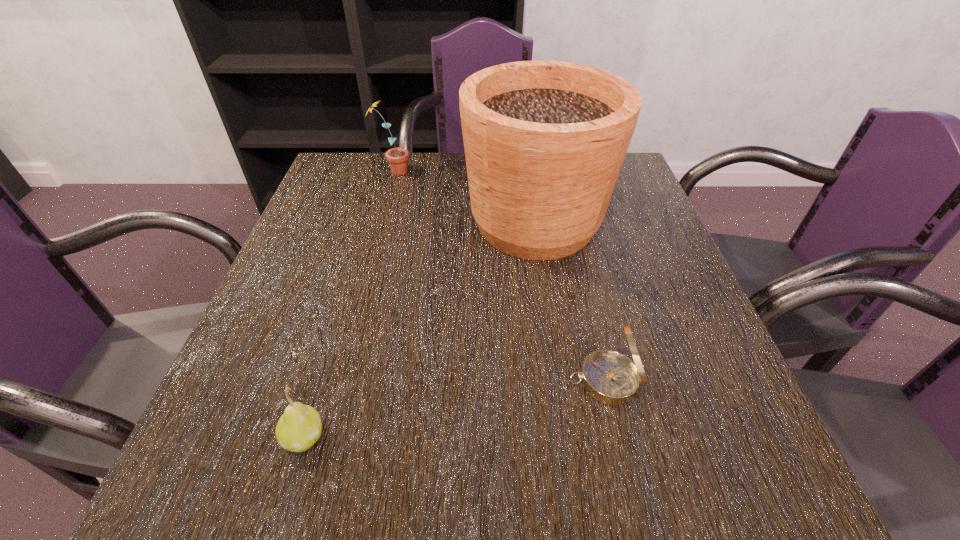
Identify the location of free space located with the dial facing the second nearest object. point(540,381).

Image resolution: width=960 pixels, height=540 pixels. In order to click on vacant space positioned 0.400m on the back of the pear in this screenshot , I will do `click(360, 250)`.

Locate an element on the screen. flowerpot that is positioned at the far edge is located at coordinates (544, 141).

Where is `sunflower that is positioned at the far edge`? This screenshot has width=960, height=540. sunflower that is positioned at the far edge is located at coordinates (397, 157).

Locate an element on the screen. Image resolution: width=960 pixels, height=540 pixels. object at the near edge is located at coordinates (299, 428).

The width and height of the screenshot is (960, 540). I want to click on sunflower positioned at the left edge, so click(x=397, y=157).

Where is `pear located at the left edge`? This screenshot has height=540, width=960. pear located at the left edge is located at coordinates (299, 428).

Where is `flowerpot located at the right edge`? This screenshot has width=960, height=540. flowerpot located at the right edge is located at coordinates (544, 141).

This screenshot has height=540, width=960. Identify the location of compass present at the right edge. (610, 377).

At what (x,y) coordinates should I click in order to perform the action: click on object that is at the far left corner. Please return your answer as a coordinate pair (x, y). Image resolution: width=960 pixels, height=540 pixels. Looking at the image, I should click on (397, 157).